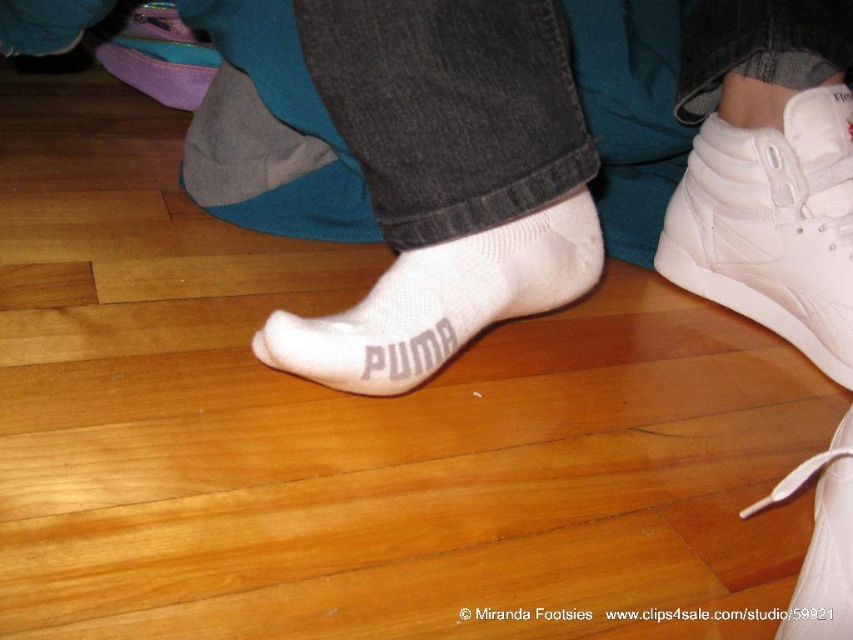
You are a fashion designer observing the image. You need to determine the spatial relationship between the white knit sock at center and the white leather shoe at lower right. Which object is positioned higher in the image?

The white knit sock at center is positioned higher than the white leather shoe at lower right.

You are a photographer setting up a shoot focused on footwear. In the image, you see the white fabric socks at center and the white knit sock at center. Which sock is positioned more to the left?

The white fabric socks at center are positioned more to the left than the white knit sock at center.